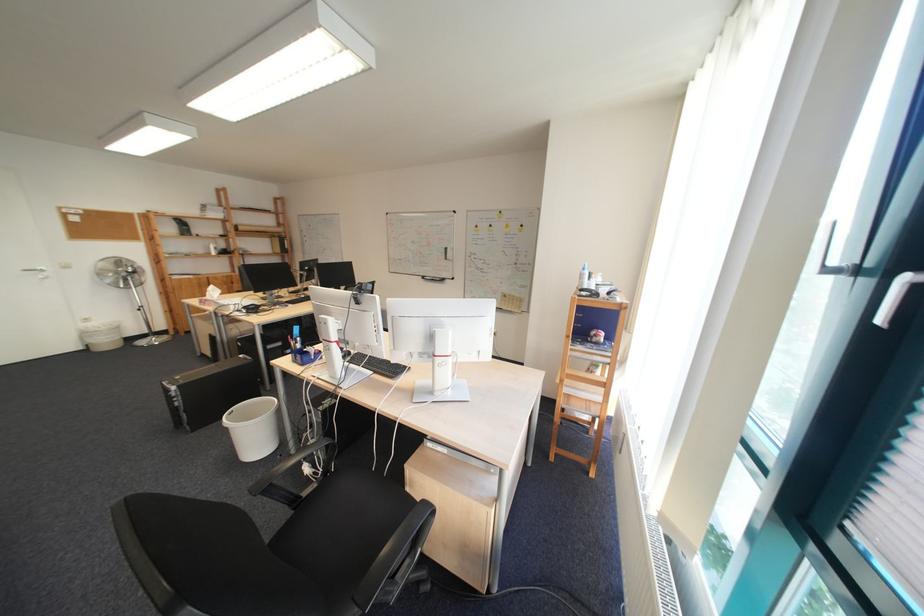
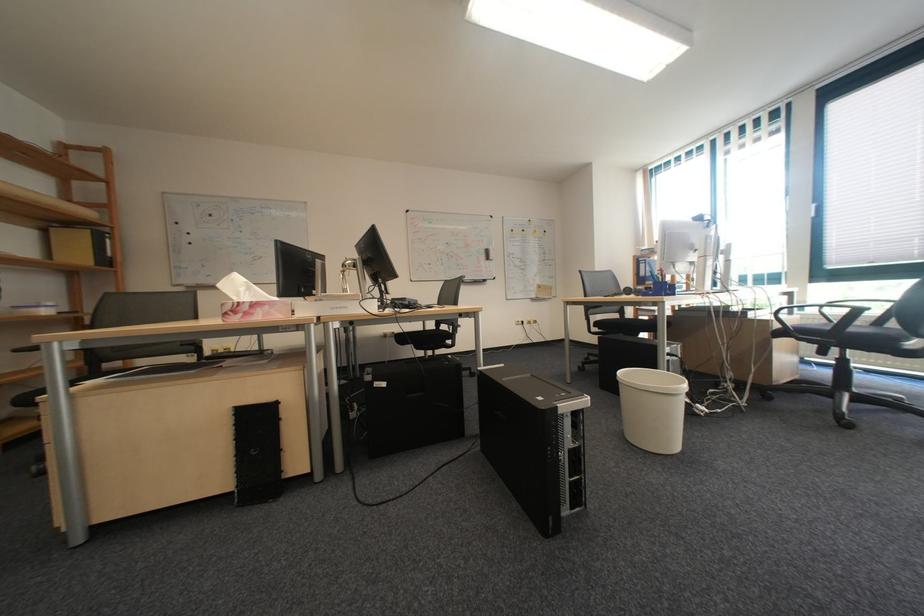
Locate, in the second image, the point that corresponds to point (293, 238) in the first image.

(103, 232)